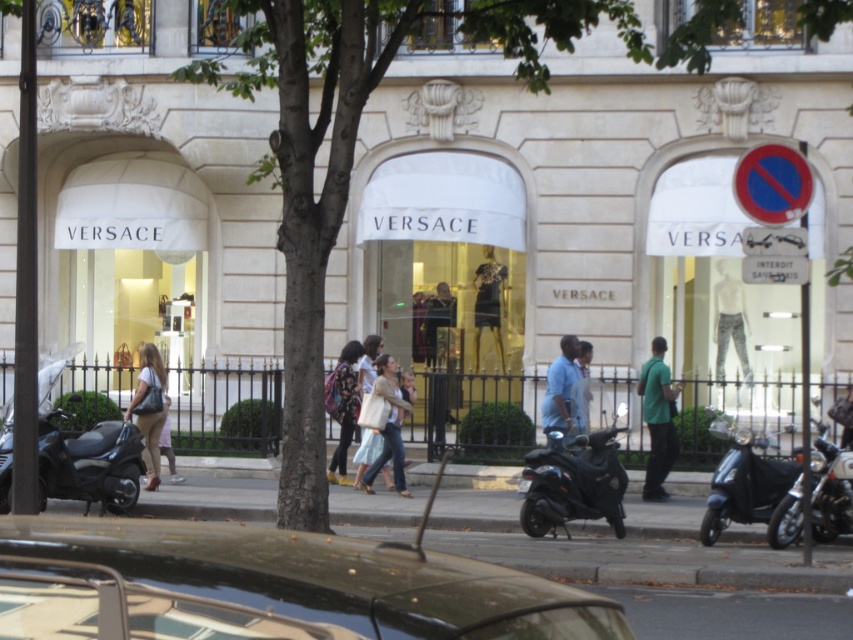
Does green leafy tree at center appear on the left side of blue shirt at center?

Indeed, green leafy tree at center is positioned on the left side of blue shirt at center.

Is green leafy tree at center shorter than blue shirt at center?

In fact, green leafy tree at center may be taller than blue shirt at center.

Does point (315, 522) come in front of point (578, 362)?

Yes, it is in front of point (578, 362).

The image size is (853, 640). I want to click on green leafy tree at center, so click(352, 154).

At what (x,y) coordinates should I click in order to perform the action: click on metallic gray car at center. Please return your answer as a coordinate pair (x, y). The image size is (853, 640). Looking at the image, I should click on (314, 579).

Locate an element on the screen. This screenshot has height=640, width=853. metallic gray car at center is located at coordinates (314, 579).

Does point (144, 448) come behind point (370, 484)?

No, it is not.

Can you confirm if light beige pants at center is smaller than matte beige handbag at center?

Yes.

Find the location of `light beige pants at center`. light beige pants at center is located at coordinates (149, 410).